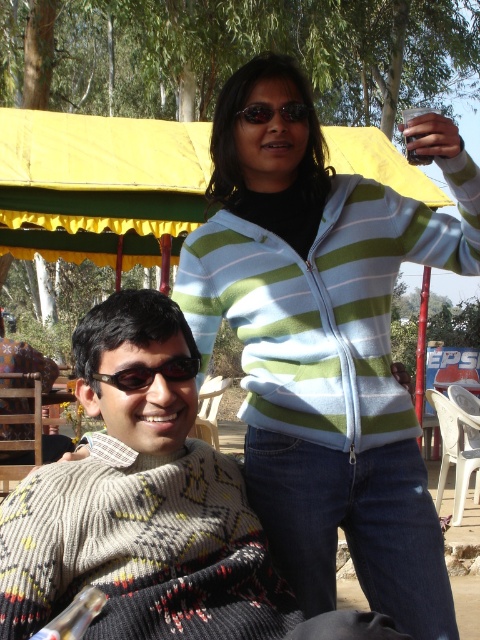
Between knitted sweater at center and sunglasses at upper center, which one is positioned higher?

sunglasses at upper center is higher up.

Is point (100, 305) less distant than point (299, 100)?

Yes.

Find the location of a particular element. knitted sweater at center is located at coordinates (140, 506).

Is knitted sweater at center taller than black rubber goggles at left?

Yes.

Does point (210, 518) lie behind point (173, 358)?

Yes, it is behind point (173, 358).

Find the location of a particular element. The height and width of the screenshot is (640, 480). knitted sweater at center is located at coordinates (140, 506).

Which is behind, point (96, 348) or point (409, 138)?

The point (409, 138) is behind.

Does knitted sweater at center appear on the left side of metallic silver cup at upper right?

Yes, knitted sweater at center is to the left of metallic silver cup at upper right.

Locate an element on the screen. This screenshot has width=480, height=640. knitted sweater at center is located at coordinates point(140,506).